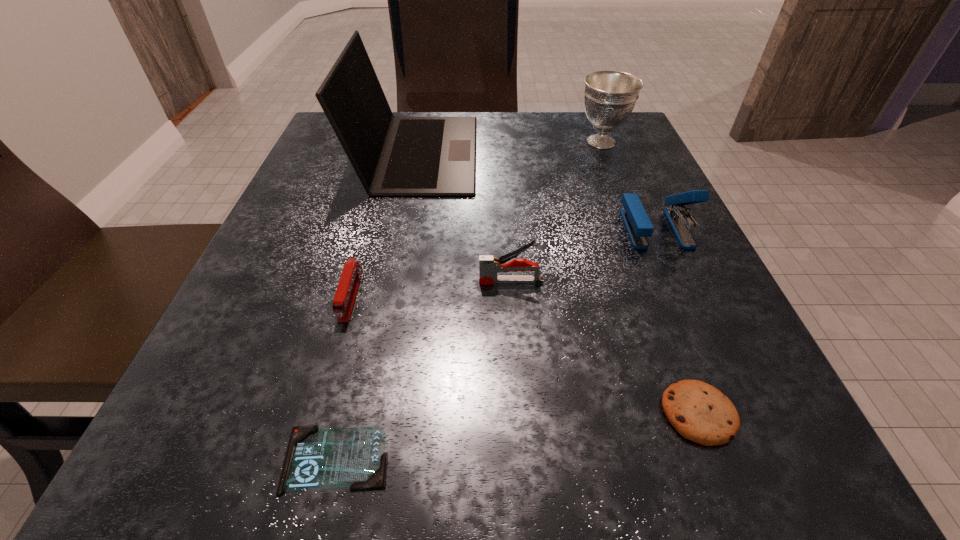
Locate an element on the screen. This screenshot has width=960, height=540. free space between the rightmost stapler and the tallest object is located at coordinates point(537,191).

Where is `free point between the laptop and the chalice`? The image size is (960, 540). free point between the laptop and the chalice is located at coordinates (509, 147).

Where is `vacant point located between the shortest object and the third shortest object`? This screenshot has width=960, height=540. vacant point located between the shortest object and the third shortest object is located at coordinates (344, 377).

Where is `vacant area between the shortest object and the chalice`? Image resolution: width=960 pixels, height=540 pixels. vacant area between the shortest object and the chalice is located at coordinates (468, 300).

At what (x,y) coordinates should I click in order to perform the action: click on empty location between the sixth shortest object and the tallest object. Please return your answer as a coordinate pair (x, y). The width and height of the screenshot is (960, 540). Looking at the image, I should click on (509, 147).

At what (x,y) coordinates should I click in order to perform the action: click on unoccupied position between the chalice and the fifth tallest object. Please return your answer as a coordinate pair (x, y). Looking at the image, I should click on (476, 218).

The width and height of the screenshot is (960, 540). In order to click on vacant area that lies between the fourth object from left to right and the chalice in this screenshot , I will do `click(556, 212)`.

Locate an element on the screen. This screenshot has width=960, height=540. object identified as the fifth closest to the shortest object is located at coordinates (638, 225).

Identify the location of object that stands as the second closest to the shortest object. (489, 266).

Identify the location of stapler that is the nearest to the fifth nearest object. The width and height of the screenshot is (960, 540). (489, 266).